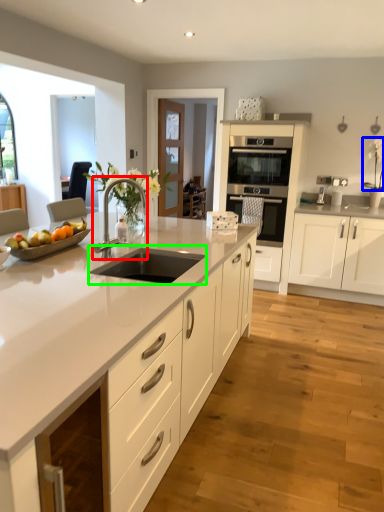
Question: Which object is positioned closest to tap (highlighted by a red box)? Select from flower (highlighted by a blue box) and sink (highlighted by a green box).

Choices:
 (A) flower
 (B) sink

Answer: (B)